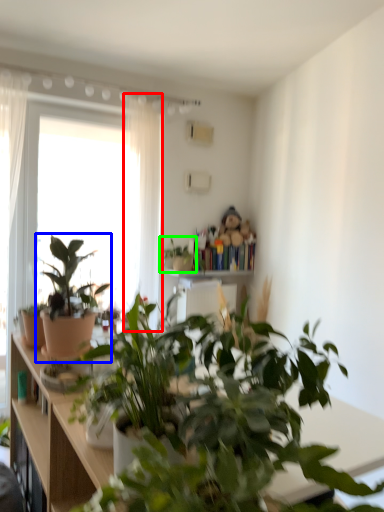
Question: Estimate the real-world distances between objects in this image. Which object is closer to curtain (highlighted by a red box), houseplant (highlighted by a blue box) or houseplant (highlighted by a green box)?

Choices:
 (A) houseplant
 (B) houseplant

Answer: (B)